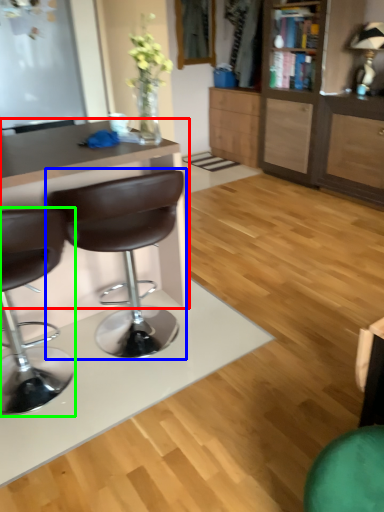
Question: Which is nearer to the desk (highlighted by a red box)? chair (highlighted by a blue box) or chair (highlighted by a green box).

Choices:
 (A) chair
 (B) chair

Answer: (A)